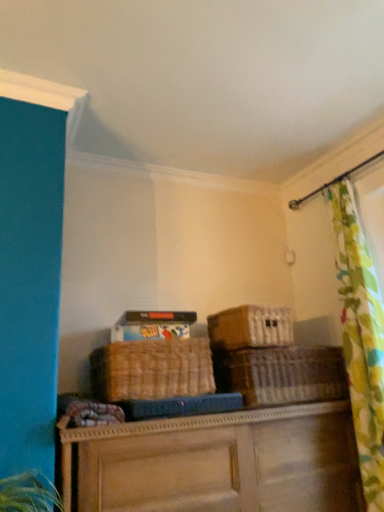
Question: Can you confirm if woven brown basket at center, the 3th basket when ordered from left to right, is positioned to the right of woven wicker basket at center?

Choices:
 (A) yes
 (B) no

Answer: (A)

Question: Considering the relative sizes of woven brown basket at center, the 3th basket when ordered from left to right, and woven wicker basket at center in the image provided, is woven brown basket at center, the 3th basket when ordered from left to right, bigger than woven wicker basket at center?

Choices:
 (A) no
 (B) yes

Answer: (A)

Question: Can you confirm if woven brown basket at center, which appears as the 1th basket when viewed from the right, is thinner than woven wicker basket at center?

Choices:
 (A) yes
 (B) no

Answer: (A)

Question: Could you tell me if woven brown basket at center, which appears as the 1th basket when viewed from the right, is turned towards woven wicker basket at center?

Choices:
 (A) yes
 (B) no

Answer: (B)

Question: Is woven wicker basket at center located within woven brown basket at center, which appears as the 1th basket when viewed from the right?

Choices:
 (A) yes
 (B) no

Answer: (B)

Question: Does woven brown basket at center, which appears as the 1th basket when viewed from the right, have a greater width compared to woven wicker basket at center?

Choices:
 (A) no
 (B) yes

Answer: (A)

Question: Can woven wicker basket at center be found inside matte cardboard storage box at upper center?

Choices:
 (A) no
 (B) yes

Answer: (A)

Question: Considering the relative sizes of matte cardboard storage box at upper center and woven wicker basket at center in the image provided, is matte cardboard storage box at upper center thinner than woven wicker basket at center?

Choices:
 (A) yes
 (B) no

Answer: (A)

Question: From the image's perspective, does matte cardboard storage box at upper center appear lower than woven wicker basket at center?

Choices:
 (A) yes
 (B) no

Answer: (B)

Question: Is matte cardboard storage box at upper center taller than woven wicker basket at center?

Choices:
 (A) no
 (B) yes

Answer: (A)

Question: From a real-world perspective, is matte cardboard storage box at upper center positioned over woven wicker basket at center based on gravity?

Choices:
 (A) yes
 (B) no

Answer: (A)

Question: Is matte cardboard storage box at upper center oriented towards woven wicker basket at center?

Choices:
 (A) no
 (B) yes

Answer: (A)

Question: From a real-world perspective, is matte cardboard storage box at upper center physically above woven brown basket at center, which appears as the 1th basket when viewed from the right?

Choices:
 (A) no
 (B) yes

Answer: (B)